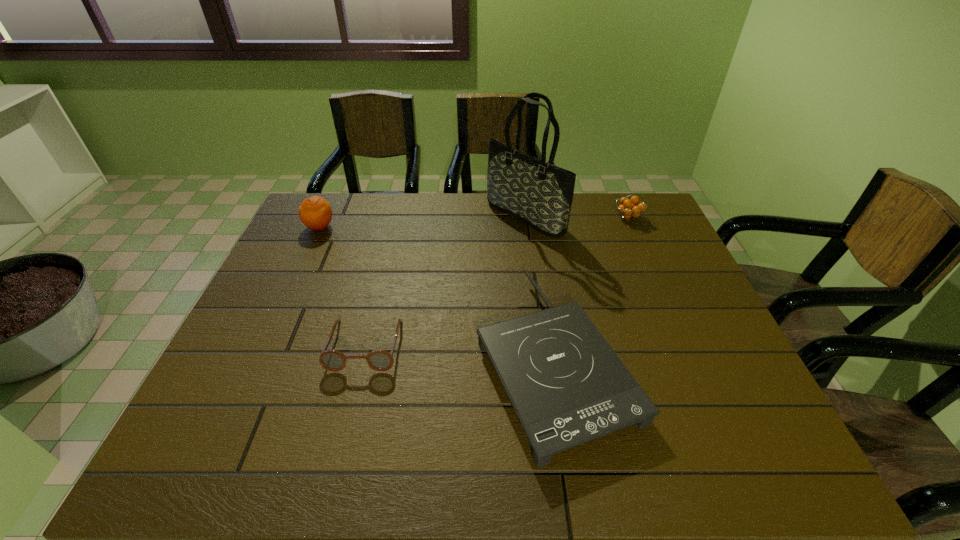
In order to click on free space located 0.190m on the front-facing side of the fourth object from right to left in this screenshot , I will do `click(339, 453)`.

Identify the location of vacant space located on the back of the hotplate. (534, 225).

You are a GUI agent. You are given a task and a screenshot of the screen. Output one action in this format:
    pyautogui.click(x=<x>, y=<y>)
    Task: Click on the tote bag present at the far edge
    
    Given the screenshot: What is the action you would take?
    pyautogui.click(x=540, y=194)

The width and height of the screenshot is (960, 540). Find the location of `object present at the near edge`. object present at the near edge is located at coordinates [x=567, y=386].

In order to click on object at the left edge in this screenshot , I will do `click(315, 212)`.

Image resolution: width=960 pixels, height=540 pixels. Identify the location of object that is at the right edge. (630, 209).

Image resolution: width=960 pixels, height=540 pixels. Identify the location of object that is at the far left corner. (315, 212).

I want to click on object present at the far right corner, so click(x=630, y=209).

In the image, there is a desktop. Where is `vacant space at the far edge`? This screenshot has width=960, height=540. vacant space at the far edge is located at coordinates (495, 233).

This screenshot has height=540, width=960. I want to click on vacant area at the near edge of the desktop, so click(x=337, y=447).